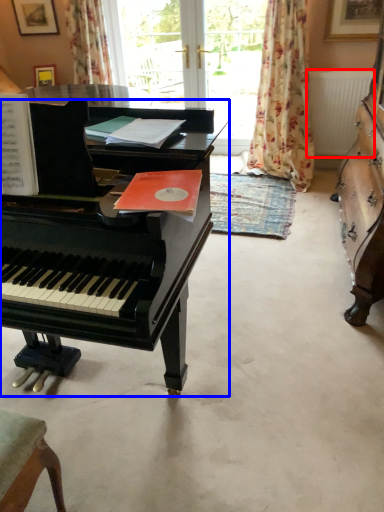
Question: Which point is closer to the camera, radiator (highlighted by a red box) or piano (highlighted by a blue box)?

Choices:
 (A) radiator
 (B) piano

Answer: (B)